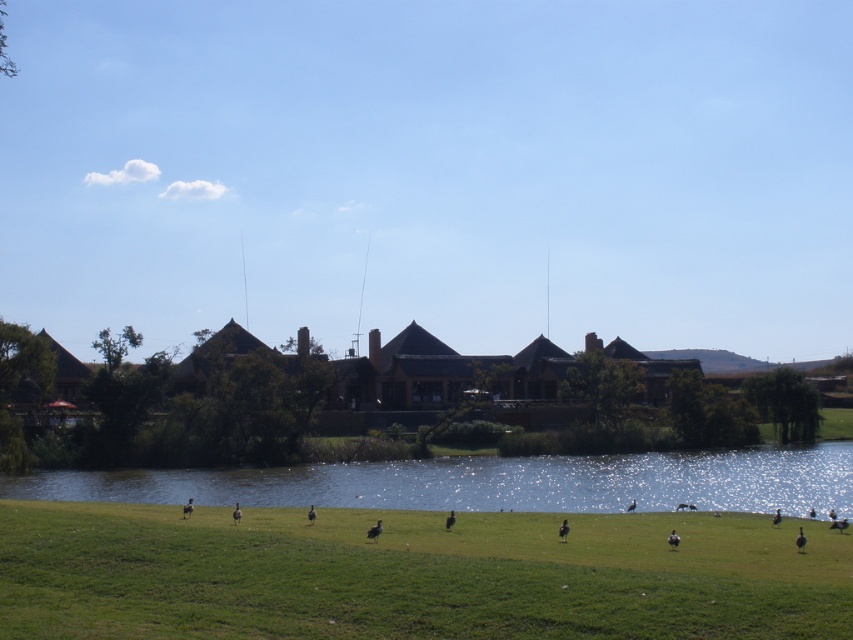
Question: Can you confirm if green grassy field at lower center is positioned to the right of blue reflective water at center?

Choices:
 (A) yes
 (B) no

Answer: (B)

Question: Is green grassy field at lower center smaller than blue reflective water at center?

Choices:
 (A) no
 (B) yes

Answer: (B)

Question: Which point appears closest to the camera in this image?

Choices:
 (A) (218, 472)
 (B) (32, 579)

Answer: (B)

Question: Which object appears farthest from the camera in this image?

Choices:
 (A) blue reflective water at center
 (B) green grassy field at lower center

Answer: (A)

Question: Which of the following is the closest to the observer?

Choices:
 (A) blue reflective water at center
 (B) green grassy field at lower center

Answer: (B)

Question: Observing the image, what is the correct spatial positioning of green grassy field at lower center in reference to blue reflective water at center?

Choices:
 (A) right
 (B) left

Answer: (B)